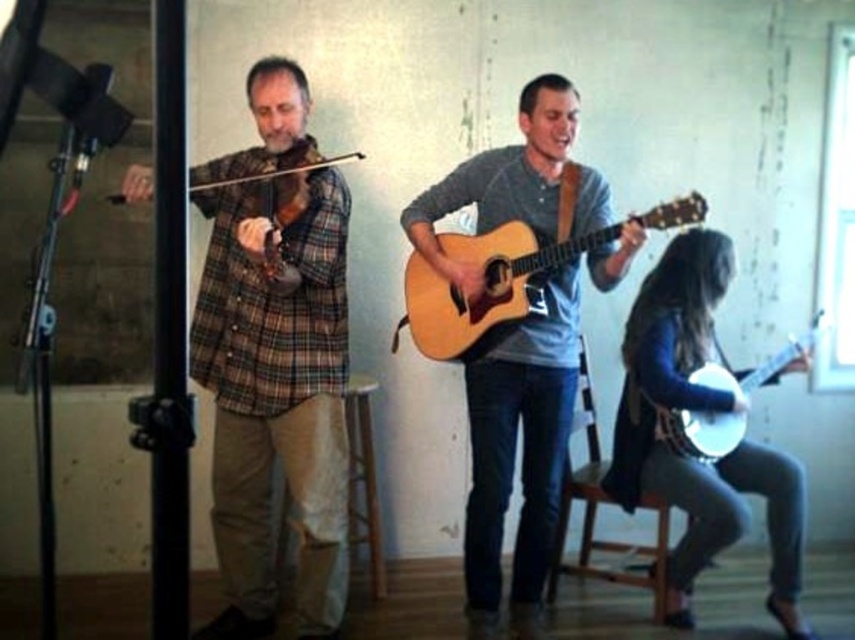
Is acoustic wood guitar at center below white glossy banjo at lower right?

Incorrect, acoustic wood guitar at center is not positioned below white glossy banjo at lower right.

Measure the distance from acoustic wood guitar at center to white glossy banjo at lower right.

A distance of 31.16 inches exists between acoustic wood guitar at center and white glossy banjo at lower right.

Measure the distance between acoustic wood guitar at center and camera.

They are 7.72 feet apart.

The image size is (855, 640). Identify the location of acoustic wood guitar at center. (485, 288).

Is brown plaid shirt at left thinner than leather banjo at lower right?

Indeed, brown plaid shirt at left has a lesser width compared to leather banjo at lower right.

Based on the photo, does brown plaid shirt at left have a larger size compared to leather banjo at lower right?

Correct, brown plaid shirt at left is larger in size than leather banjo at lower right.

Find the location of `brown plaid shirt at left`. brown plaid shirt at left is located at coordinates pos(275,392).

Is point (342, 584) closer to camera compared to point (354, 419)?

Yes, it is in front of point (354, 419).

Does brown plaid shirt at left have a greater width compared to brown wood stool at center?

Correct, the width of brown plaid shirt at left exceeds that of brown wood stool at center.

This screenshot has width=855, height=640. What are the coordinates of `brown plaid shirt at left` in the screenshot? It's located at (275, 392).

This screenshot has width=855, height=640. I want to click on brown plaid shirt at left, so click(275, 392).